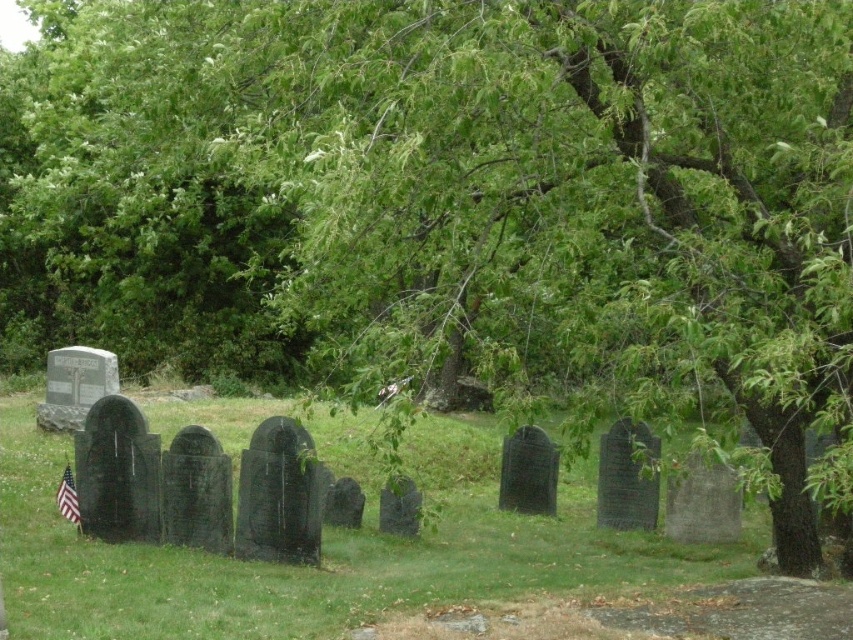
You are standing at the edge of the cemetery looking towards the green grass at center and the american flag at lower left. Which object is closer to you?

The american flag at lower left is closer to you because it is positioned under the green grass at center, indicating it is nearer in the scene.